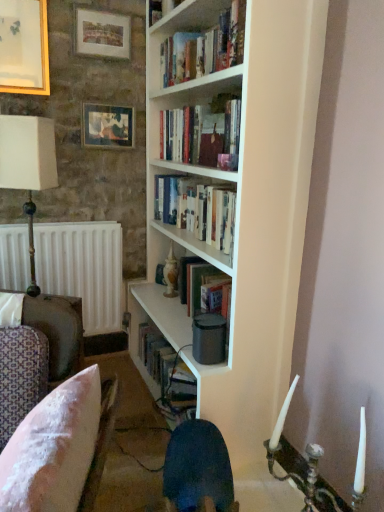
Question: Is pink fabric cushion at lower left bigger or smaller than matte wooden picture frame at upper left, placed as the 1th picture frame when sorted from right to left?

Choices:
 (A) small
 (B) big

Answer: (B)

Question: Is pink fabric cushion at lower left taller or shorter than matte wooden picture frame at upper left, arranged as the third picture frame when viewed from the left?

Choices:
 (A) short
 (B) tall

Answer: (B)

Question: Which is farther from the hardcover books at center, arranged as the 1th book when ordered from the bottom?

Choices:
 (A) white paperbacks at upper center, which is the 1th book in top-to-bottom order
 (B) white matte radiator at left
 (C) pink fabric cushion at lower left
 (D) matte wooden picture frame at upper center, which ranks as the second picture frame in left-to-right order
 (E) white fabric-covered lampshade at left

Answer: (C)

Question: Estimate the real-world distances between objects in this image. Which object is farther from the white paperbacks at upper center, which is the 1th book in top-to-bottom order?

Choices:
 (A) hardcover books at center, arranged as the 1th book when ordered from the bottom
 (B) white fabric-covered lampshade at left
 (C) matte wooden picture frame at upper left, placed as the 1th picture frame when sorted from right to left
 (D) wooden picture frame at upper left, the 1th picture frame viewed from the left
 (E) white matte bookcase at center

Answer: (B)